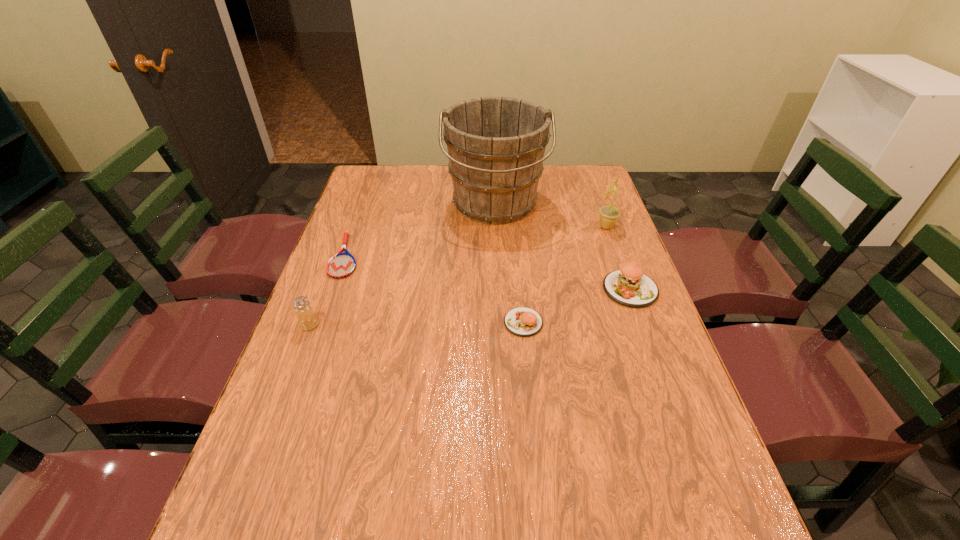
Where is `sunflower that is at the right edge`? sunflower that is at the right edge is located at coordinates (609, 215).

Where is `vacant region at the far edge of the desktop`? The width and height of the screenshot is (960, 540). vacant region at the far edge of the desktop is located at coordinates (415, 188).

You are a GUI agent. You are given a task and a screenshot of the screen. Output one action in this format:
    pyautogui.click(x=<x>, y=<y>)
    Task: Click on the free space at the near edge
    The height and width of the screenshot is (540, 960).
    Given the screenshot: What is the action you would take?
    pyautogui.click(x=560, y=470)

You are a GUI agent. You are given a task and a screenshot of the screen. Output one action in this format:
    pyautogui.click(x=<x>, y=<y>)
    Task: Click on the free location at the left edge
    
    Given the screenshot: What is the action you would take?
    pyautogui.click(x=369, y=299)

I want to click on vacant space at the right edge, so click(x=626, y=312).

Locate an element on the screen. blank area at the far left corner is located at coordinates (392, 190).

Image resolution: width=960 pixels, height=540 pixels. I want to click on vacant area that lies between the second tallest object and the tallest object, so click(x=550, y=215).

At what (x,y) coordinates should I click in order to perform the action: click on unoccupied area between the fifth tallest object and the tallest object. Please return your answer as a coordinate pair (x, y). The height and width of the screenshot is (540, 960). Looking at the image, I should click on click(509, 264).

You are a GUI agent. You are given a task and a screenshot of the screen. Output one action in this format:
    pyautogui.click(x=<x>, y=<y>)
    Task: Click on the free spot between the left patty and the saltshaker
    This screenshot has height=540, width=960.
    Given the screenshot: What is the action you would take?
    pyautogui.click(x=417, y=324)

Locate an element on the screen. The image size is (960, 540). vacant area that lies between the shortest object and the taller patty is located at coordinates (488, 273).